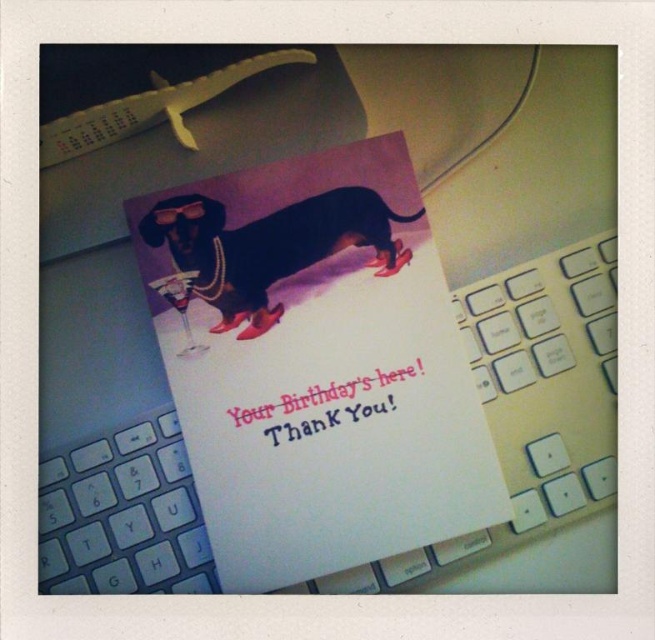
You are a photographer holding a camera and want to take a closeup shot of the shiny black dog at center. The camera requires a minimum distance of 30 inches to focus properly. Can you take the photo without moving the camera or the dog?

The shiny black dog at center and camera are 31.31 inches apart, which is more than the required 30 inches, so yes, you can take the photo without moving either.

Consider the image. You are designing a birthday card layout and need to ensure the shiny black dog at center and the pink paper text at center are arranged correctly. According to the image, which object is positioned higher?

The shiny black dog at center is positioned higher than the pink paper text at center.